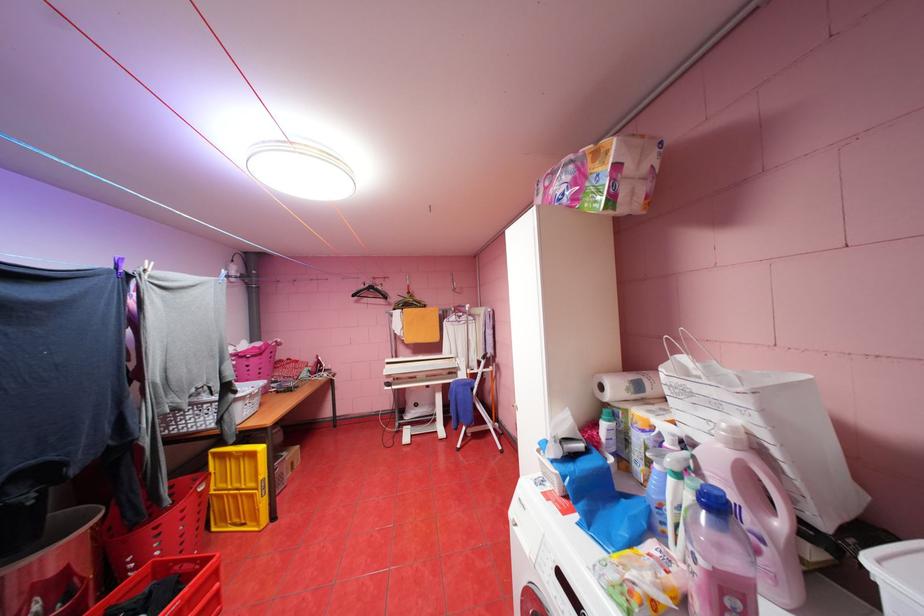
This screenshot has height=616, width=924. What are the coordinates of `blue bottle cap` in the screenshot? It's located at (715, 513).